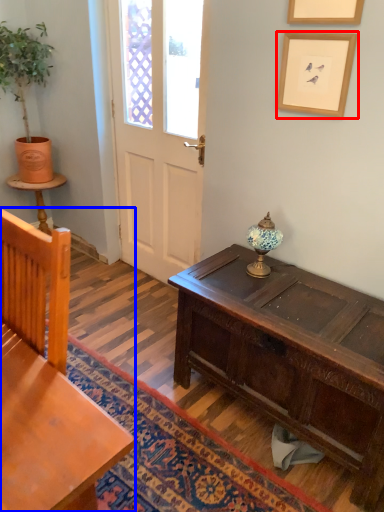
Question: Which object appears closest to the camera in this image, picture frame (highlighted by a red box) or chair (highlighted by a blue box)?

Choices:
 (A) picture frame
 (B) chair

Answer: (B)